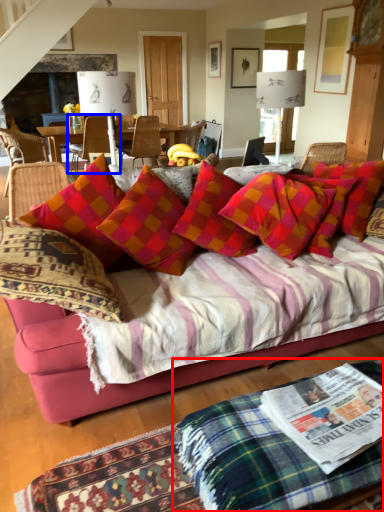
Question: Which object appears farthest to the camera in this image, quilt (highlighted by a red box) or chair (highlighted by a blue box)?

Choices:
 (A) quilt
 (B) chair

Answer: (B)